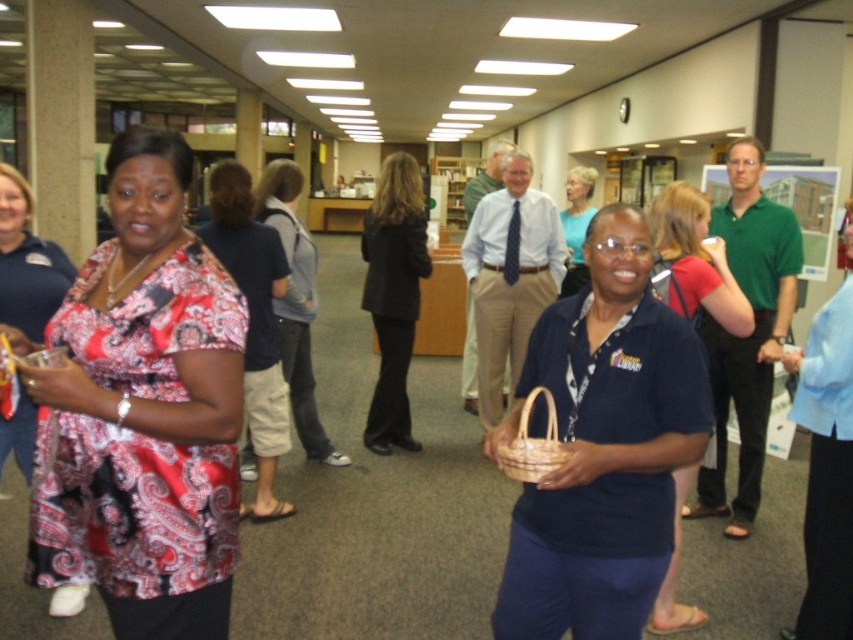
From the picture: You are standing in the library and see the patterned silk blouse at left and the woven brown basket at center. Which object is positioned further to the left?

The patterned silk blouse at left is positioned further to the left than the woven brown basket at center.

You are standing at the origin point in the image. Which of the two points, point (669, 211) or point (585, 180), is closer to you?

Point (585, 180) is closer to you because it is behind point (669, 211).